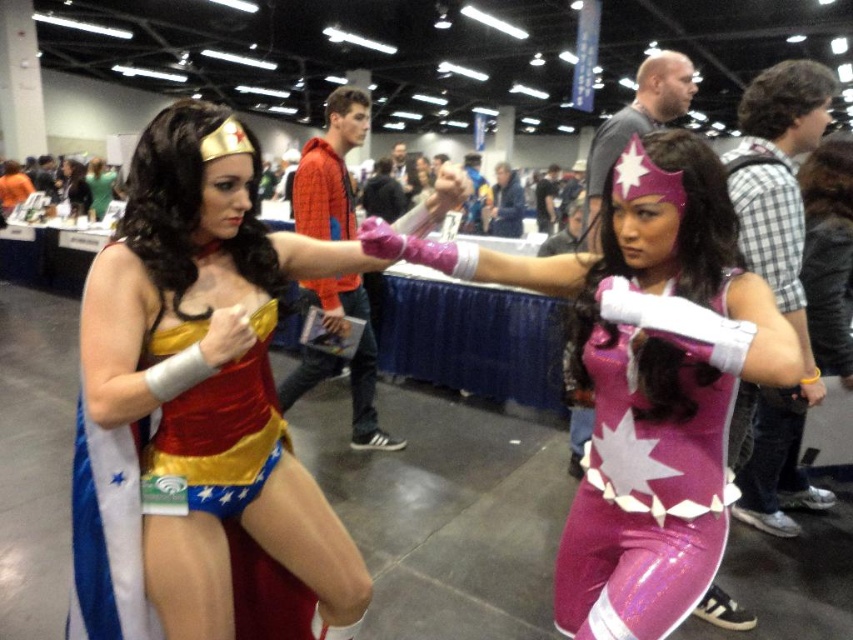
Describe the element at coordinates (199, 406) in the screenshot. The height and width of the screenshot is (640, 853). I see `shiny satin costume at center` at that location.

Is point (146, 460) less distant than point (727, 376)?

No, it is behind (727, 376).

Which is in front, point (158, 288) or point (599, 406)?

Point (158, 288) is more forward.

This screenshot has height=640, width=853. In order to click on shiny satin costume at center in this screenshot , I will do `click(199, 406)`.

Between shiny satin costume at center and purple glossy costume at center, which one appears on the left side from the viewer's perspective?

From the viewer's perspective, shiny satin costume at center appears more on the left side.

Does point (189, 330) lie behind point (677, 310)?

Yes, point (189, 330) is behind point (677, 310).

Which is behind, point (201, 269) or point (718, 248)?

Positioned behind is point (201, 269).

Locate an element on the screen. shiny satin costume at center is located at coordinates (199, 406).

Does purple glossy costume at center appear on the right side of purple glossy bodysuit at center?

Incorrect, purple glossy costume at center is not on the right side of purple glossy bodysuit at center.

Image resolution: width=853 pixels, height=640 pixels. What are the coordinates of `purple glossy costume at center` in the screenshot? It's located at (643, 380).

I want to click on purple glossy costume at center, so click(x=643, y=380).